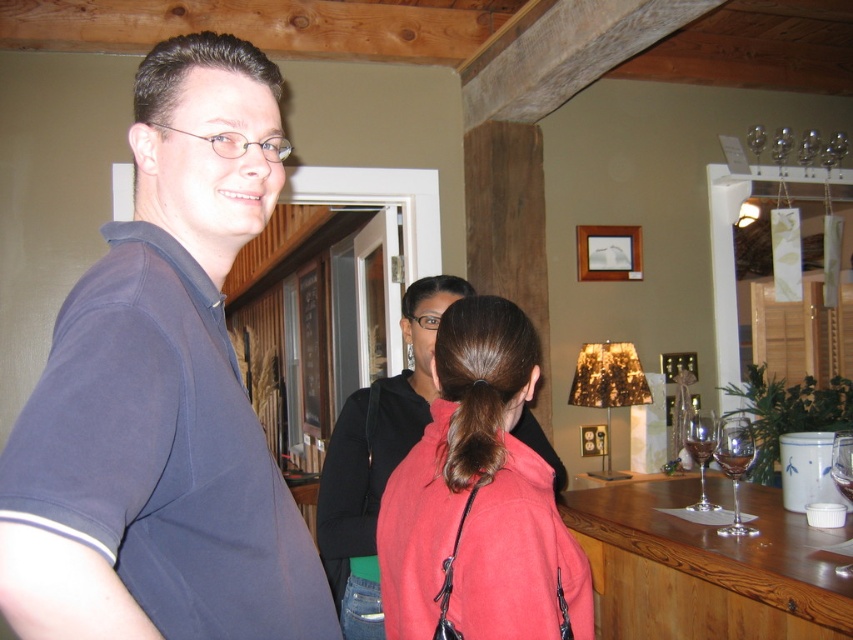
Question: Is dark blue shirt at center to the right of brown silky hair at center from the viewer's perspective?

Choices:
 (A) yes
 (B) no

Answer: (B)

Question: Which object is positioned farthest from the brown silky hair at center?

Choices:
 (A) matte red sweater at center
 (B) dark blue shirt at center

Answer: (B)

Question: Which of the following is the closest to the observer?

Choices:
 (A) (471, 376)
 (B) (194, 362)

Answer: (B)

Question: In this image, where is matte red sweater at center located relative to brown silky hair at center?

Choices:
 (A) above
 (B) below

Answer: (B)

Question: From the image, what is the correct spatial relationship of matte red sweater at center in relation to brown silky hair at center?

Choices:
 (A) right
 (B) left

Answer: (A)

Question: Estimate the real-world distances between objects in this image. Which object is closer to the matte red sweater at center?

Choices:
 (A) dark blue shirt at center
 (B) brown silky hair at center

Answer: (B)